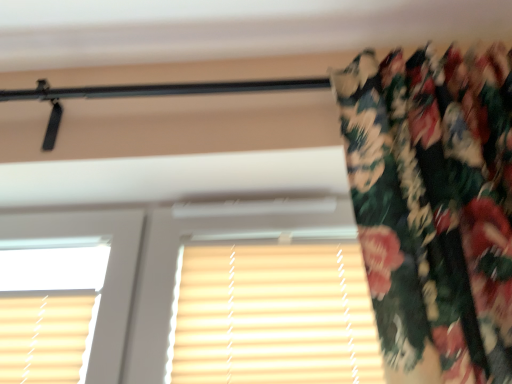
This screenshot has width=512, height=384. Describe the element at coordinates (273, 312) in the screenshot. I see `beige wood blinds at center` at that location.

Image resolution: width=512 pixels, height=384 pixels. Find the location of `beige wood blinds at center`. beige wood blinds at center is located at coordinates (273, 312).

Where is `beige wood blinds at center`? The image size is (512, 384). beige wood blinds at center is located at coordinates (x=273, y=312).